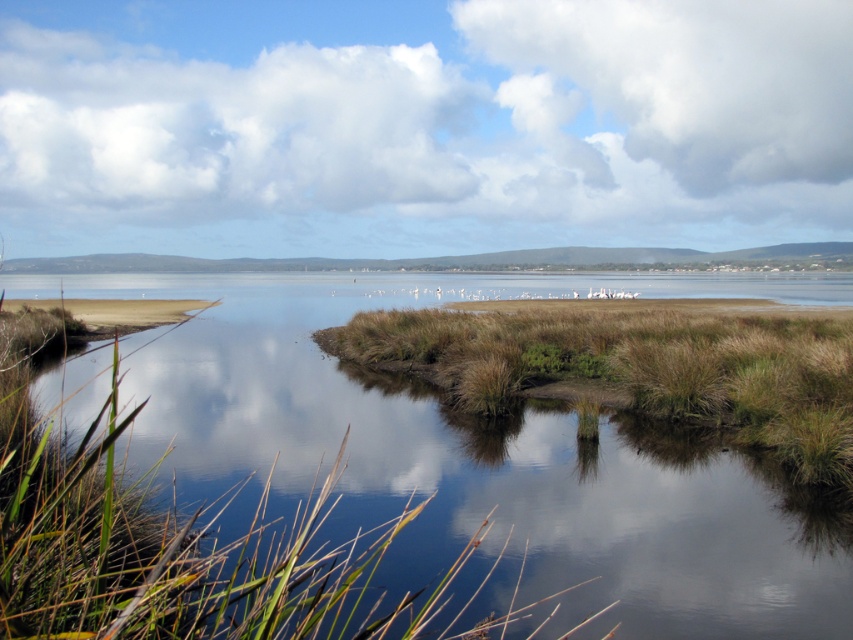
Question: Can you confirm if green grassy land at center is bigger than brown grassy island at center?

Choices:
 (A) yes
 (B) no

Answer: (A)

Question: Is green grassy land at center above brown grassy island at center?

Choices:
 (A) yes
 (B) no

Answer: (A)

Question: In this image, where is green grassy land at center located relative to brown grassy island at center?

Choices:
 (A) left
 (B) right

Answer: (A)

Question: Which of the following is the farthest from the observer?

Choices:
 (A) (225, 394)
 (B) (592, 376)

Answer: (A)

Question: Which point appears farthest from the camera in this image?

Choices:
 (A) (485, 470)
 (B) (740, 308)

Answer: (B)

Question: Which point is farther to the camera?

Choices:
 (A) brown grassy island at center
 (B) green grassy land at center

Answer: (A)